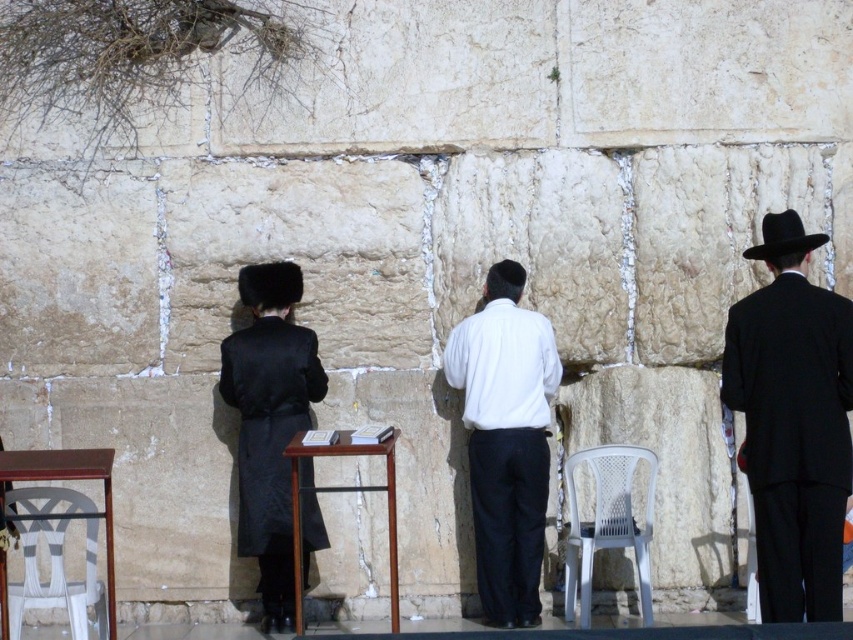
Is white matte shirt at center wider than white plastic chair at lower left?

Yes.

Is white matte shirt at center bigger than white plastic chair at lower left?

Indeed, white matte shirt at center has a larger size compared to white plastic chair at lower left.

Which is behind, point (520, 284) or point (54, 520)?

Positioned behind is point (520, 284).

The width and height of the screenshot is (853, 640). Find the location of `white matte shirt at center`. white matte shirt at center is located at coordinates (506, 440).

I want to click on black wool hat at center, so click(793, 422).

Which is above, black wool hat at center or wooden table at center?

black wool hat at center is higher up.

Which is in front, point (738, 406) or point (296, 433)?

Point (738, 406) is in front.

Where is `black wool hat at center`? The width and height of the screenshot is (853, 640). black wool hat at center is located at coordinates (793, 422).

Between white matte shirt at center and white plastic chair at center, which one appears on the right side from the viewer's perspective?

white plastic chair at center

Which of these two, white matte shirt at center or white plastic chair at center, stands shorter?

With less height is white plastic chair at center.

Describe the element at coordinates (506, 440) in the screenshot. This screenshot has width=853, height=640. I see `white matte shirt at center` at that location.

Where is `white matte shirt at center`? The width and height of the screenshot is (853, 640). white matte shirt at center is located at coordinates (506, 440).